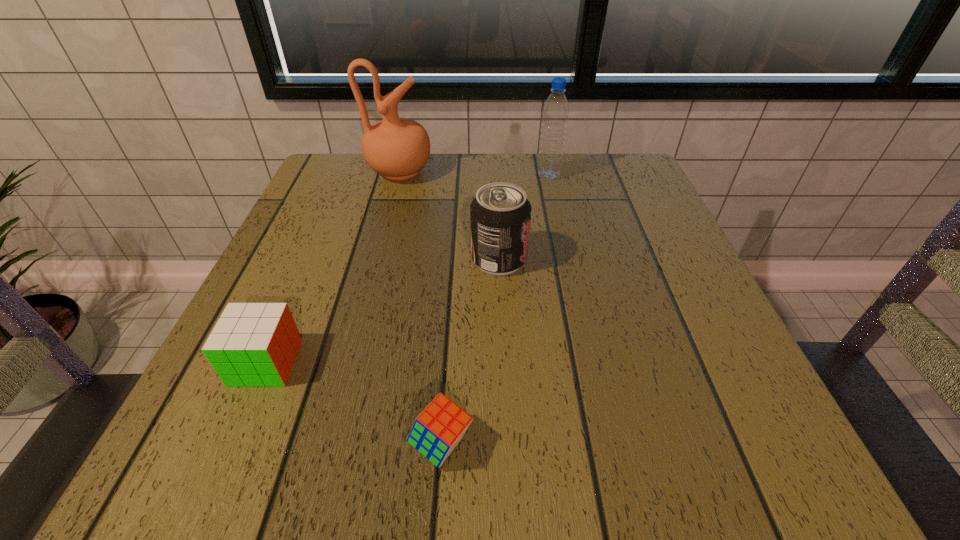
The width and height of the screenshot is (960, 540). Identify the location of free spot between the nearest object and the second nearest object. (353, 403).

You are a GUI agent. You are given a task and a screenshot of the screen. Output one action in this format:
    pyautogui.click(x=<x>, y=<y>)
    Task: Click on the vacant point located between the rightmost object and the leftmost object
    
    Given the screenshot: What is the action you would take?
    pyautogui.click(x=407, y=269)

Find the location of a particular element. Image resolution: width=960 pixels, height=540 pixels. empty location between the farther cube and the soda can is located at coordinates (382, 310).

At what (x,y) coordinates should I click in order to perform the action: click on free space between the nearer cube and the leftmost object. Please return your answer as a coordinate pair (x, y). Looking at the image, I should click on (353, 403).

Choose which object is the third nearest neighbor to the rightmost object. Please provide its 2D coordinates. Your answer should be formatted as a tuple, i.e. [(x, y)], where the tuple contains the x and y coordinates of a point satisfying the conditions above.

[(437, 430)]

Find the location of a particular element. object identified as the second closest to the pottery is located at coordinates (555, 113).

Image resolution: width=960 pixels, height=540 pixels. Identify the location of free location that satisfies the following two spatial constraints: 1. on the spout of the water bottle; 2. on the right side of the fourth object from right to left. (399, 175).

The height and width of the screenshot is (540, 960). I want to click on free space that satisfies the following two spatial constraints: 1. on the spout of the pottery; 2. on the back side of the rightmost object, so (399, 175).

The image size is (960, 540). I want to click on free space in the image that satisfies the following two spatial constraints: 1. on the back side of the soda can; 2. on the right side of the nearer cube, so click(454, 259).

Find the location of `vacant space that satisfies the following two spatial constraints: 1. on the back side of the third nearest object; 2. on the left side of the water bottle`. vacant space that satisfies the following two spatial constraints: 1. on the back side of the third nearest object; 2. on the left side of the water bottle is located at coordinates (495, 175).